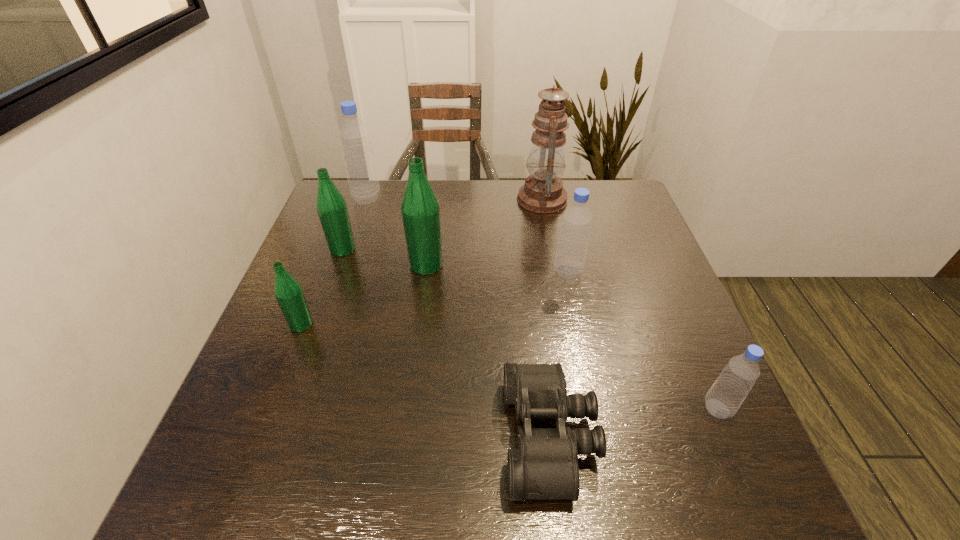
Where is `the third closest green bottle to the second biggest blue bottle`? The width and height of the screenshot is (960, 540). the third closest green bottle to the second biggest blue bottle is located at coordinates (288, 292).

Locate an element on the screen. Image resolution: width=960 pixels, height=540 pixels. free location that satisfies the following two spatial constraints: 1. on the back side of the nearest green bottle; 2. on the left side of the biggest blue bottle is located at coordinates (350, 198).

You are a GUI agent. You are given a task and a screenshot of the screen. Output one action in this format:
    pyautogui.click(x=<x>, y=<y>)
    Task: Click on the free space that satisfies the following two spatial constraints: 1. on the back side of the fifth object from right to left; 2. on the left side of the sixth farthest object
    This screenshot has height=540, width=960.
    Given the screenshot: What is the action you would take?
    pyautogui.click(x=324, y=265)